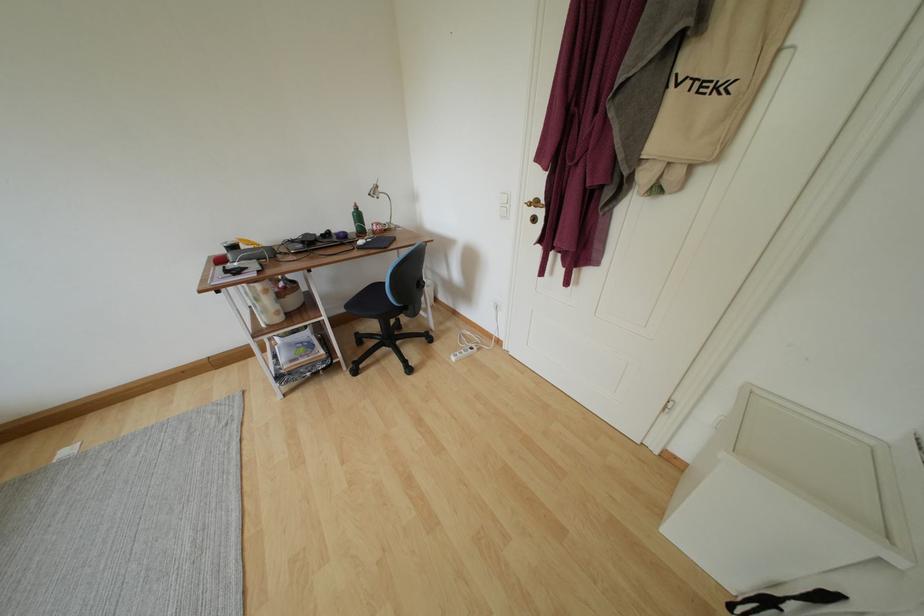
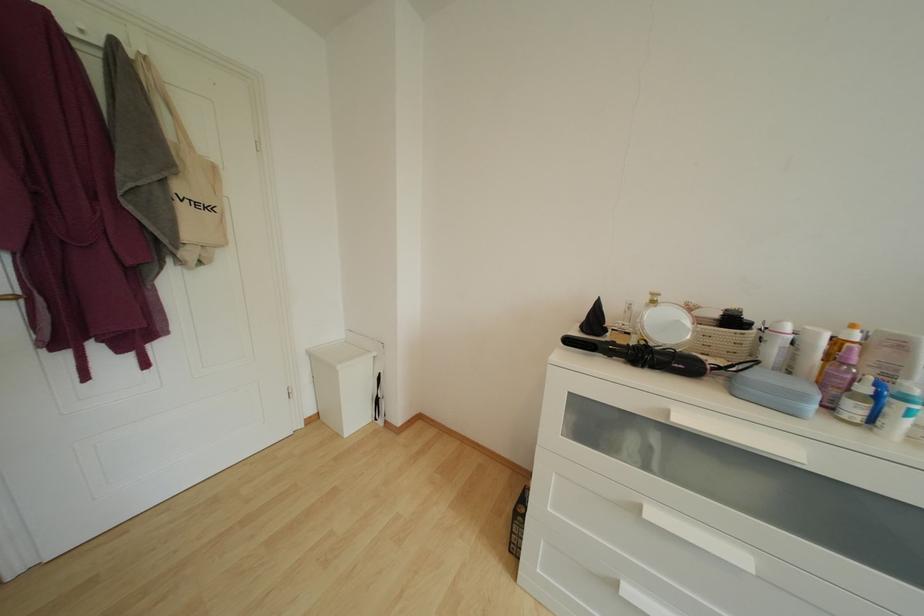
The first image is from the beginning of the video and the second image is from the end. How did the camera likely rotate when shooting the video?

The camera's rotation is toward right-down.